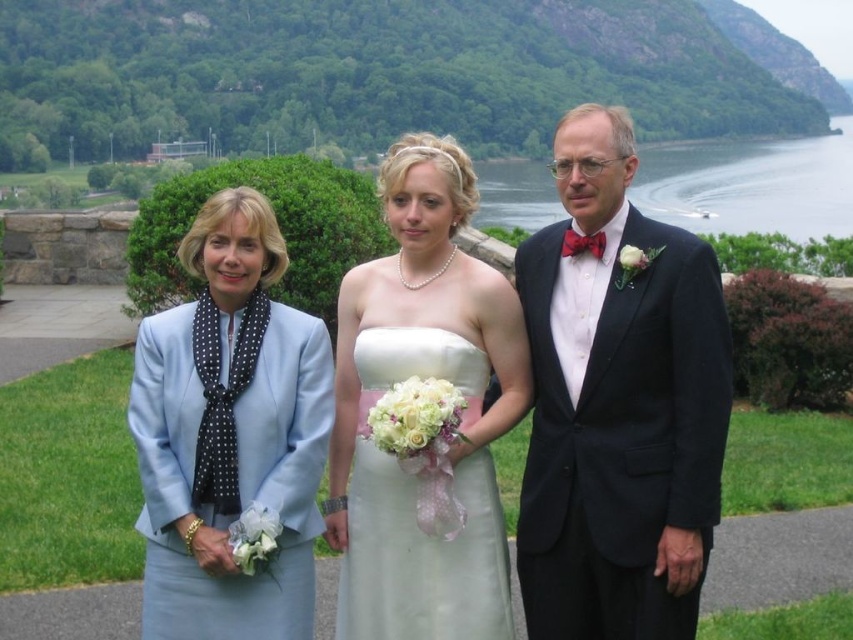
Does matte black suit at center appear on the right side of white satin dress at center?

Yes, matte black suit at center is to the right of white satin dress at center.

Is point (693, 316) positioned after point (402, 513)?

No, (693, 316) is closer to viewer.

Image resolution: width=853 pixels, height=640 pixels. Describe the element at coordinates (618, 404) in the screenshot. I see `matte black suit at center` at that location.

This screenshot has height=640, width=853. I want to click on matte black suit at center, so click(618, 404).

Can you confirm if white satin dress at center is positioned to the left of clear water at right?

Indeed, white satin dress at center is positioned on the left side of clear water at right.

Is point (357, 561) less distant than point (650, 148)?

That is True.

Where is `white satin dress at center`? The width and height of the screenshot is (853, 640). white satin dress at center is located at coordinates (421, 557).

What do you see at coordinates (229, 433) in the screenshot? I see `light blue fabric dress at left` at bounding box center [229, 433].

Which is below, light blue fabric dress at left or clear water at right?

Positioned lower is light blue fabric dress at left.

Who is more forward, (293, 337) or (488, 164)?

Positioned in front is point (293, 337).

Where is `light blue fabric dress at left`? This screenshot has height=640, width=853. light blue fabric dress at left is located at coordinates tap(229, 433).